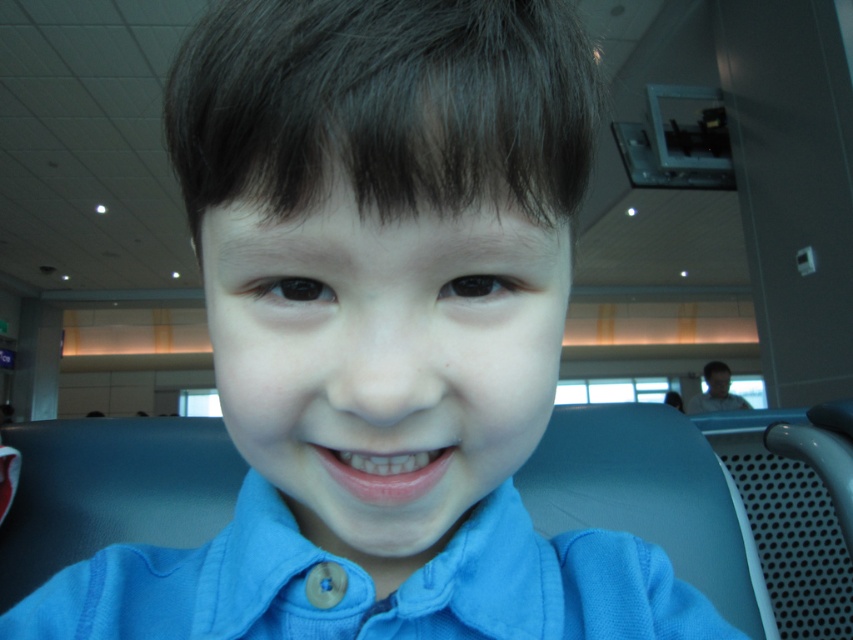
Question: Among these objects, which one is farthest from the camera?

Choices:
 (A) matte black face at upper right
 (B) blue cotton dress shirt at center

Answer: (A)

Question: Can you confirm if blue cotton dress shirt at center is thinner than matte black face at upper right?

Choices:
 (A) yes
 (B) no

Answer: (A)

Question: Does blue cotton dress shirt at center lie in front of matte black face at upper right?

Choices:
 (A) no
 (B) yes

Answer: (B)

Question: Among these points, which one is farthest from the camera?

Choices:
 (A) (650, 582)
 (B) (695, 406)

Answer: (B)

Question: Is blue cotton dress shirt at center to the right of matte black face at upper right from the viewer's perspective?

Choices:
 (A) no
 (B) yes

Answer: (A)

Question: Which point appears closest to the camera in this image?

Choices:
 (A) (643, 577)
 (B) (728, 406)

Answer: (A)